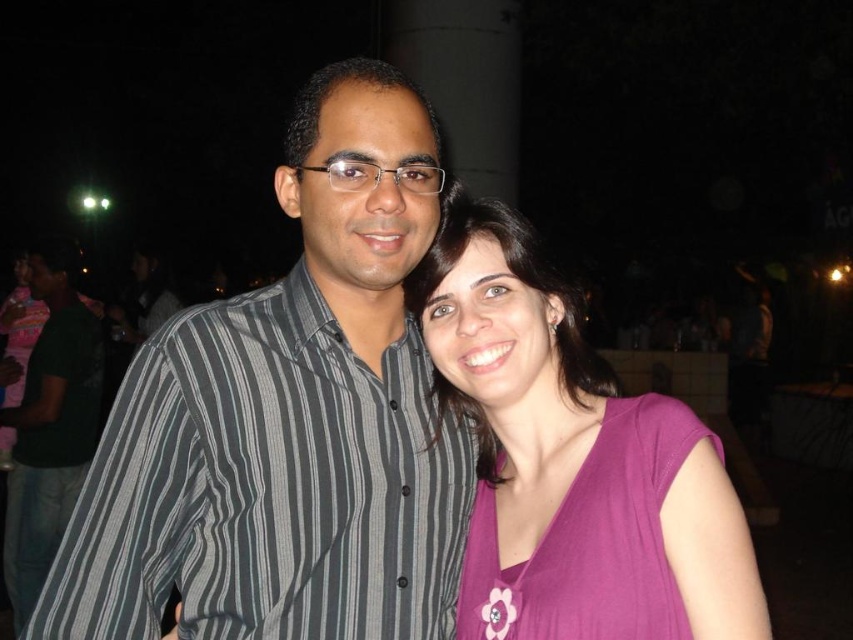
Question: Considering the relative positions of striped shirt at center and purple fabric dress at right in the image provided, where is striped shirt at center located with respect to purple fabric dress at right?

Choices:
 (A) left
 (B) right

Answer: (A)

Question: Is purple fabric dress at right wider than dark green shirt at left?

Choices:
 (A) yes
 (B) no

Answer: (B)

Question: Which point is closer to the camera?

Choices:
 (A) (558, 364)
 (B) (628, 595)
 (C) (22, 528)

Answer: (B)

Question: Which point is closer to the camera taking this photo?

Choices:
 (A) (498, 561)
 (B) (62, 276)
 (C) (614, 621)
 (D) (358, 593)

Answer: (C)

Question: Is purple fabric dress at right thinner than dark green shirt at left?

Choices:
 (A) yes
 (B) no

Answer: (A)

Question: Which object appears closest to the camera in this image?

Choices:
 (A) purple matte shirt at center
 (B) dark green shirt at left
 (C) purple fabric dress at right

Answer: (A)